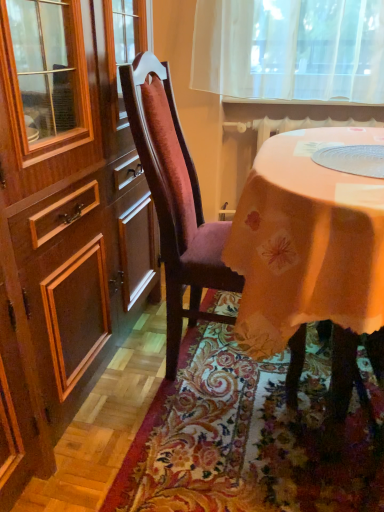
Question: Is velvet burgundy chair at center aimed at floral carpet at lower center?

Choices:
 (A) yes
 (B) no

Answer: (B)

Question: Does velvet burgundy chair at center have a greater height compared to floral carpet at lower center?

Choices:
 (A) yes
 (B) no

Answer: (A)

Question: Is velvet burgundy chair at center thinner than floral carpet at lower center?

Choices:
 (A) no
 (B) yes

Answer: (B)

Question: Is velvet burgundy chair at center smaller than floral carpet at lower center?

Choices:
 (A) yes
 (B) no

Answer: (B)

Question: Does velvet burgundy chair at center contain floral carpet at lower center?

Choices:
 (A) yes
 (B) no

Answer: (B)

Question: Is velvet burgundy chair at center wider than floral carpet at lower center?

Choices:
 (A) yes
 (B) no

Answer: (B)

Question: From a real-world perspective, is floral carpet at lower center over velvet burgundy chair at center?

Choices:
 (A) yes
 (B) no

Answer: (B)

Question: Is floral carpet at lower center directly adjacent to velvet burgundy chair at center?

Choices:
 (A) yes
 (B) no

Answer: (B)

Question: Is the position of floral carpet at lower center less distant than that of velvet burgundy chair at center?

Choices:
 (A) no
 (B) yes

Answer: (B)

Question: Is floral carpet at lower center shorter than velvet burgundy chair at center?

Choices:
 (A) yes
 (B) no

Answer: (A)

Question: Is floral carpet at lower center thinner than velvet burgundy chair at center?

Choices:
 (A) no
 (B) yes

Answer: (A)

Question: Does floral carpet at lower center appear on the right side of velvet burgundy chair at center?

Choices:
 (A) no
 (B) yes

Answer: (B)

Question: From their relative heights in the image, would you say floral carpet at lower center is taller or shorter than velvet burgundy chair at center?

Choices:
 (A) tall
 (B) short

Answer: (B)